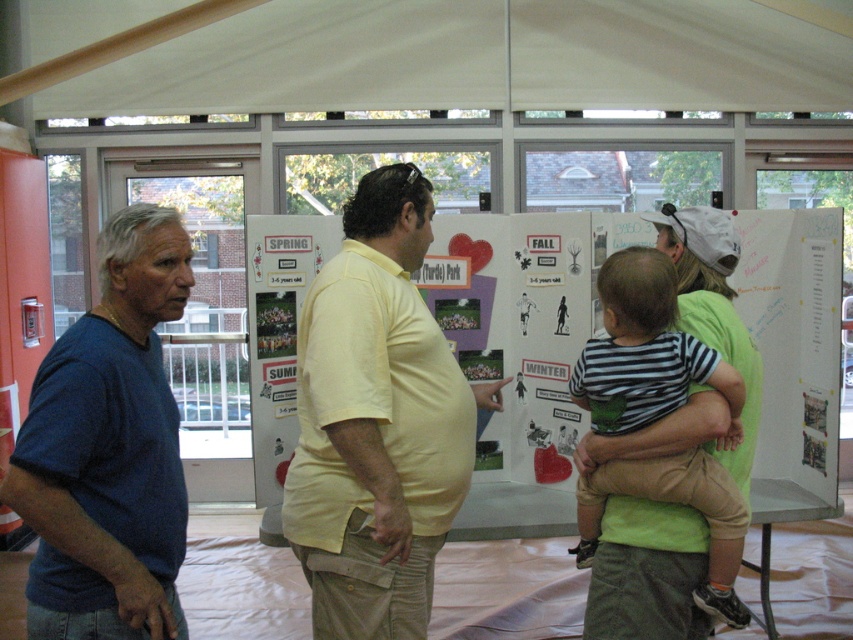
Question: Among these points, which one is farthest from the camera?

Choices:
 (A) (453, 440)
 (B) (476, 48)
 (C) (660, 467)

Answer: (B)

Question: Which point is farther from the camera taking this photo?

Choices:
 (A) (732, 429)
 (B) (502, 42)
 (C) (339, 282)
 (D) (155, 547)

Answer: (B)

Question: Which object appears closest to the camera in this image?

Choices:
 (A) blue cotton shirt at left
 (B) white fabric canopy at upper center
 (C) striped cotton shirt at center

Answer: (A)

Question: Is blue cotton shirt at left to the right of striped cotton shirt at center from the viewer's perspective?

Choices:
 (A) no
 (B) yes

Answer: (A)

Question: Can you confirm if white fabric canopy at upper center is positioned above blue cotton shirt at left?

Choices:
 (A) no
 (B) yes

Answer: (B)

Question: Is white fabric canopy at upper center wider than blue cotton shirt at left?

Choices:
 (A) no
 (B) yes

Answer: (B)